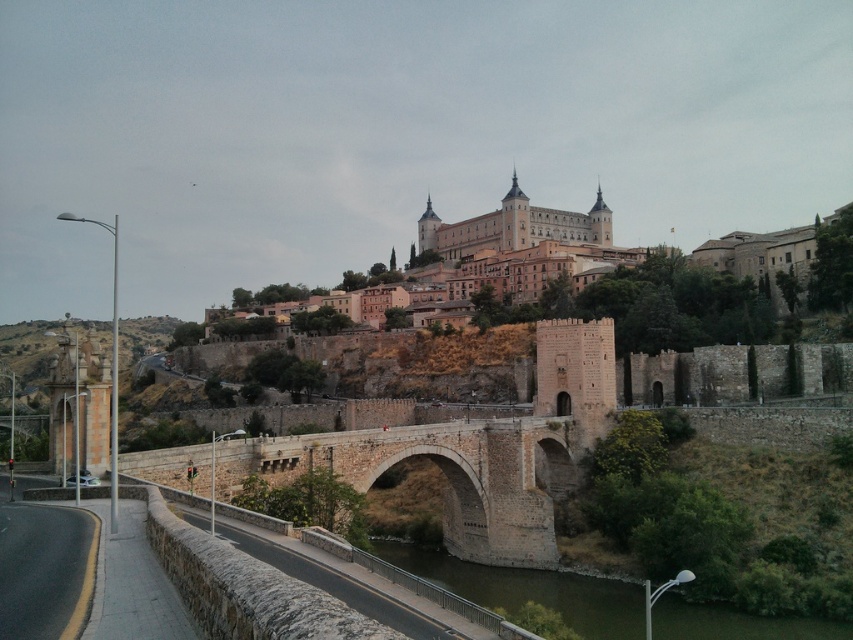
Question: Which object is the closest to the brown stone castle at center?

Choices:
 (A) greenish-brown water at lower center
 (B) stone castle at center
 (C) brown stone bridge at center

Answer: (B)

Question: Can you confirm if stone castle at center is positioned to the left of brown stone bridge at center?

Choices:
 (A) yes
 (B) no

Answer: (B)

Question: Considering the real-world distances, which object is closest to the brown stone castle at center?

Choices:
 (A) brown stone bridge at center
 (B) greenish-brown water at lower center

Answer: (A)

Question: Is brown stone bridge at center to the left of greenish-brown water at lower center from the viewer's perspective?

Choices:
 (A) yes
 (B) no

Answer: (A)

Question: Considering the real-world distances, which object is closest to the brown stone bridge at center?

Choices:
 (A) stone castle at center
 (B) brown stone castle at center
 (C) greenish-brown water at lower center

Answer: (C)

Question: Is brown stone bridge at center bigger than greenish-brown water at lower center?

Choices:
 (A) yes
 (B) no

Answer: (A)